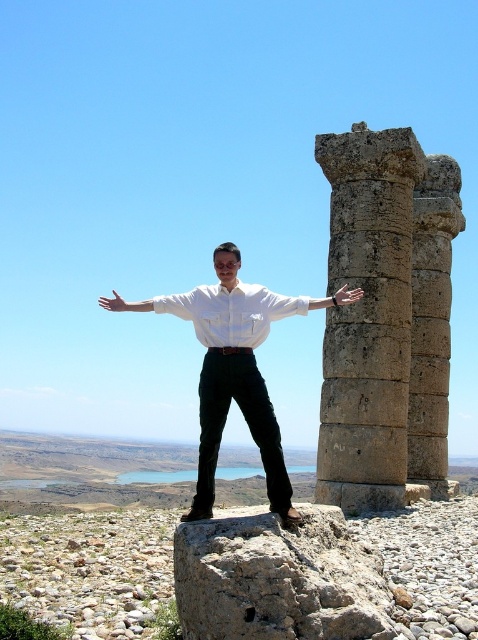
You are a photographer trying to capture a closeup shot of both the white matte arm at center and the metallic silver hand at right in the same frame. Given the camera you have can focus on objects within a 30 feet range, will you be able to take the photo?

The white matte arm at center and metallic silver hand at right are 33.99 feet apart. Since the camera can only focus within 30 feet, the distance between them exceeds the camera range. Therefore, you cannot capture both in the same focused frame.

Consider the image. What is the spatial relationship between the gray stone column at right and the white matte arm at right?

The gray stone column at right is located to the right of the white matte arm at right.